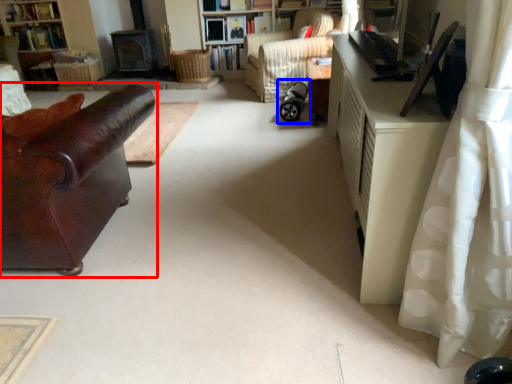
Question: Which object appears farthest to the camera in this image, studio couch (highlighted by a red box) or baby carriage (highlighted by a blue box)?

Choices:
 (A) studio couch
 (B) baby carriage

Answer: (B)